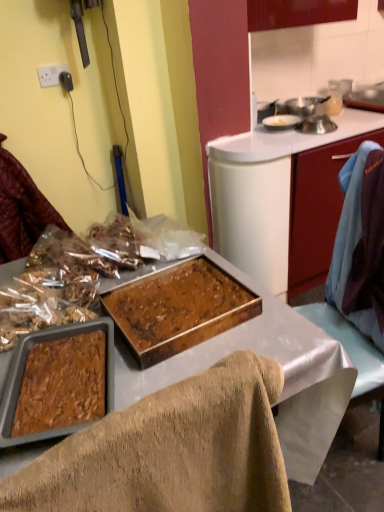
Question: Is shiny plastic bag of nuts at left inside the boundaries of brown textured tray at center, or outside?

Choices:
 (A) inside
 (B) outside

Answer: (B)

Question: From the image's perspective, relative to brown textured tray at center, is shiny plastic bag of nuts at left above or below?

Choices:
 (A) above
 (B) below

Answer: (A)

Question: Estimate the real-world distances between objects in this image. Which object is farther from the brown textured tray at center?

Choices:
 (A) white plastic power outlet at upper left
 (B) shiny plastic bag of nuts at left
 (C) matte red cabinet at right
 (D) brown crumbly mixture at left, arranged as the 1th food when viewed from the back
 (E) brown crumbly cake at center, the second food positioned from the back

Answer: (A)

Question: Estimate the real-world distances between objects in this image. Which object is farther from the brown crumbly cake at center, which is counted as the first food, starting from the front?

Choices:
 (A) white plastic power outlet at upper left
 (B) shiny plastic bag of nuts at left
 (C) metallic silver pot at upper right
 (D) matte red cabinet at right
 (E) brown textured tray at center

Answer: (A)